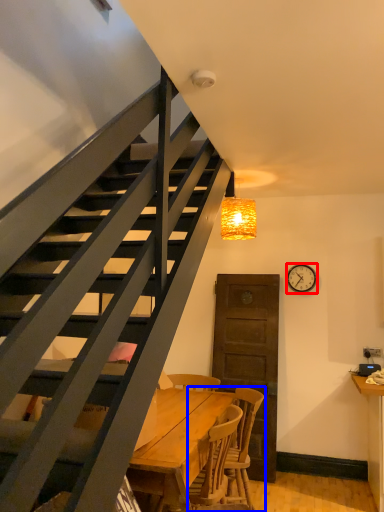
Question: Which object is closer to the camera taking this photo, clock (highlighted by a red box) or chair (highlighted by a blue box)?

Choices:
 (A) clock
 (B) chair

Answer: (B)